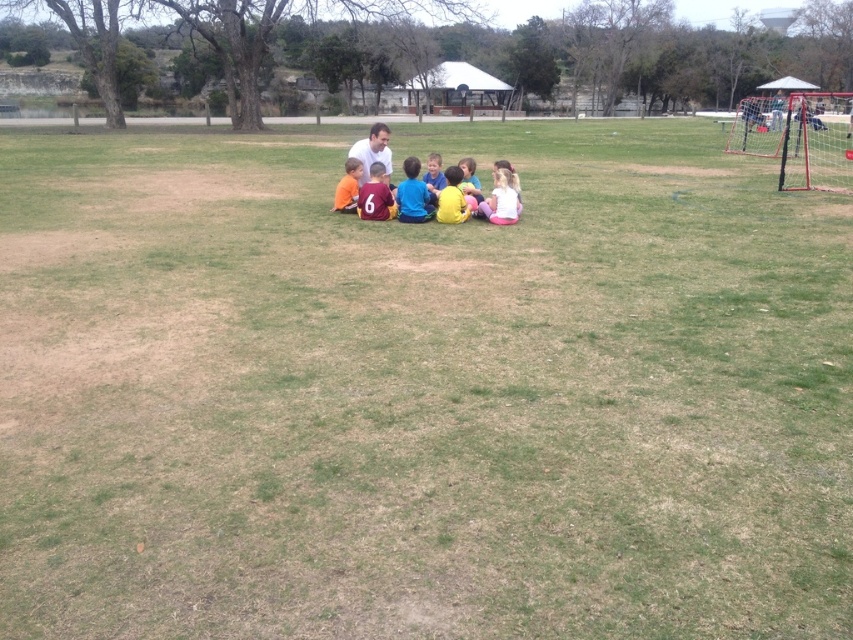
You are a photographer taking a picture of the group of children and the adult. You want to ensure both the matte blue shirt at center and the matte pink shirt at center are clearly visible in the photo. Based on their positions, which shirt should you focus on to capture both in the frame?

The matte blue shirt at center is in front of the matte pink shirt at center, so focusing on the matte blue shirt at center will ensure both are visible as it is closer to the camera.

You are a photographer trying to capture a clear shot of both the matte blue shirt at center and the orange jersey at center. Based on their positions, which one is closer to the camera?

The matte blue shirt at center is positioned under the orange jersey at center, meaning it is closer to the camera.

You are a photographer positioned at the edge of the grassy field. You want to take a photo of the orange jersey at center and orange fabric shirt at center so that both are clearly visible in the frame. Given that your camera has a minimum focus distance of 12 inches, will you be able to capture both objects in sharp focus without moving closer?

The orange jersey at center is 13.02 inches away from the orange fabric shirt at center. Since the minimum focus distance is 12 inches, the distance between them is greater than the camera can handle in a single frame. Therefore, you might need to adjust your position or use a different camera setting to ensure both are in focus.